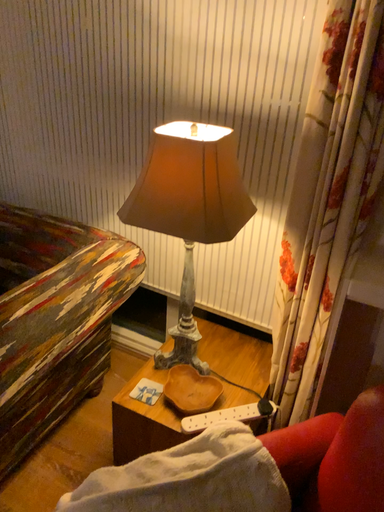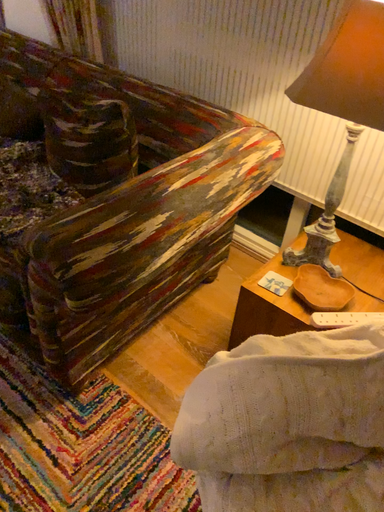
Question: Which way did the camera rotate in the video?

Choices:
 (A) rotated upward
 (B) rotated downward

Answer: (B)